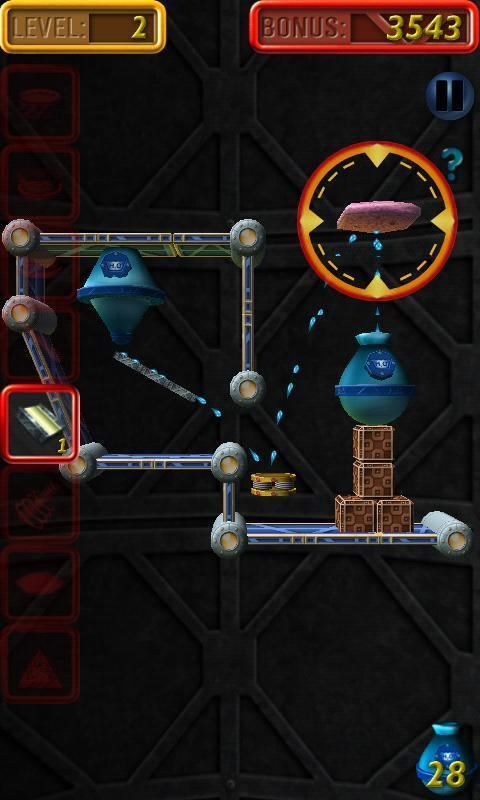
The image size is (480, 800). Identify the location of wall. pos(139,618), pos(433,317).